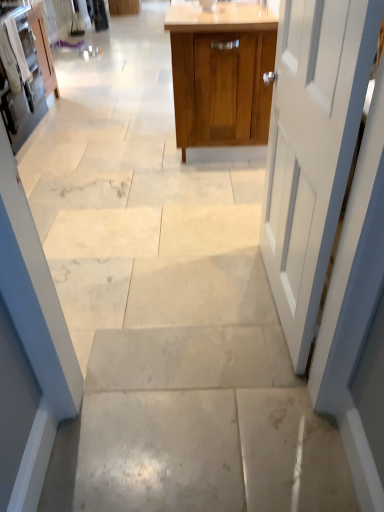
Question: Is matte white cabinet at upper left, which is the third cabinetry in right-to-left order, oriented towards matte white cabinet at left, which is counted as the second cabinetry, starting from the left?

Choices:
 (A) yes
 (B) no

Answer: (B)

Question: Is matte white cabinet at upper left, which is the third cabinetry in right-to-left order, smaller than matte white cabinet at left, which is counted as the second cabinetry, starting from the right?

Choices:
 (A) no
 (B) yes

Answer: (B)

Question: Is matte white cabinet at upper left, which is the third cabinetry in right-to-left order, next to matte white cabinet at left, which is counted as the second cabinetry, starting from the left, and touching it?

Choices:
 (A) no
 (B) yes

Answer: (A)

Question: Considering the relative sizes of matte white cabinet at upper left, the 1th cabinetry from the left, and matte white cabinet at left, which is counted as the second cabinetry, starting from the right, in the image provided, is matte white cabinet at upper left, the 1th cabinetry from the left, wider than matte white cabinet at left, which is counted as the second cabinetry, starting from the right,?

Choices:
 (A) no
 (B) yes

Answer: (A)

Question: Is matte white cabinet at upper left, the 1th cabinetry from the left, at the left side of matte white cabinet at left, which is counted as the second cabinetry, starting from the left?

Choices:
 (A) yes
 (B) no

Answer: (A)

Question: Does matte white cabinet at upper left, the 1th cabinetry from the left, contain matte white cabinet at left, which is counted as the second cabinetry, starting from the left?

Choices:
 (A) yes
 (B) no

Answer: (B)

Question: From a real-world perspective, is matte white cabinet at upper left, the 1th cabinetry from the left, below white painted wood door at right?

Choices:
 (A) yes
 (B) no

Answer: (A)

Question: Is matte white cabinet at upper left, which is the third cabinetry in right-to-left order, shorter than white painted wood door at right?

Choices:
 (A) yes
 (B) no

Answer: (A)

Question: Is matte white cabinet at upper left, the 1th cabinetry from the left, taller than white painted wood door at right?

Choices:
 (A) yes
 (B) no

Answer: (B)

Question: Is white painted wood door at right a part of matte white cabinet at upper left, the 1th cabinetry from the left?

Choices:
 (A) yes
 (B) no

Answer: (B)

Question: Is matte white cabinet at upper left, the 1th cabinetry from the left, bigger than white painted wood door at right?

Choices:
 (A) no
 (B) yes

Answer: (A)

Question: Does matte white cabinet at upper left, which is the third cabinetry in right-to-left order, come in front of white painted wood door at right?

Choices:
 (A) yes
 (B) no

Answer: (B)

Question: From a real-world perspective, does matte white cabinet at left, which is counted as the second cabinetry, starting from the right, stand above white painted wood door at right?

Choices:
 (A) no
 (B) yes

Answer: (A)